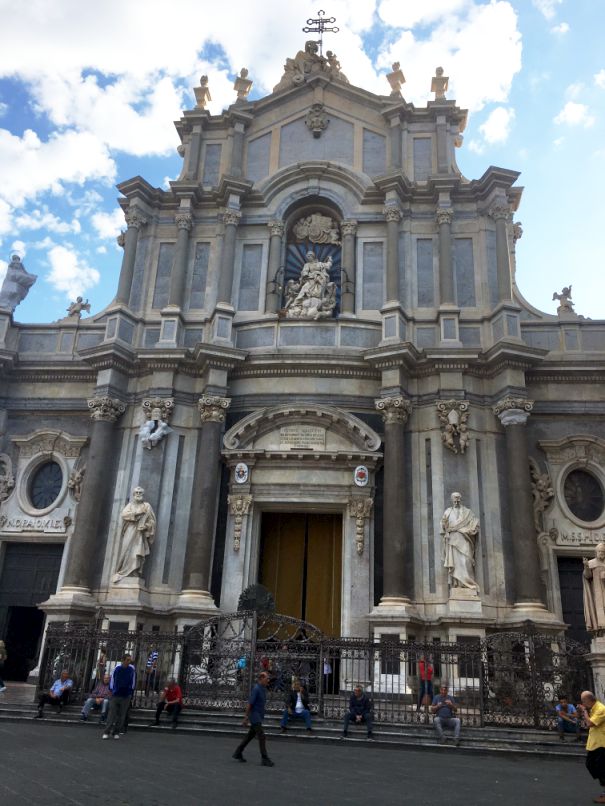
Locate an element on the screen. left window is located at coordinates (51, 484).